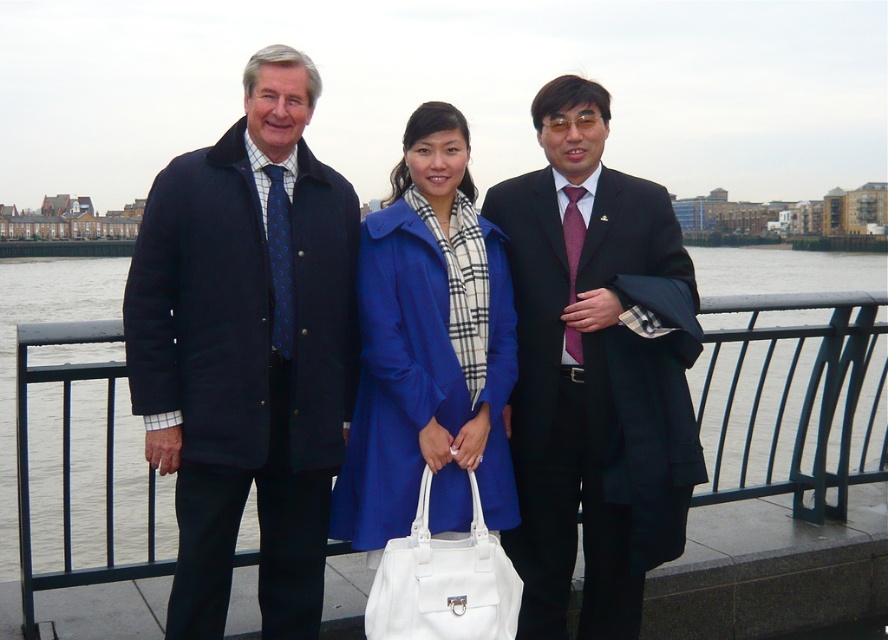
You are a photographer trying to capture a clear shot of the matte black water at center and the white leather handbag at center. Which object should you focus on first if you want to ensure both are in focus without adjusting the camera settings?

The matte black water at center is much taller than the white leather handbag at center, so focusing on the taller object first would help ensure both are in focus.

You are a photographer planning to take a group photo of the three individuals in the scene. You want to ensure that both the matte black coat at center and the matte black water at center are clearly visible in the frame. Given that your camera has a minimum focus distance of 15 meters, will you be able to capture both objects in sharp focus?

The distance between the matte black coat at center and the matte black water at center is 18.15 meters. Since the camera requires a minimum focus distance of 15 meters, the 18.15 meters distance exceeds this threshold. Therefore, the camera can focus on both objects as they are beyond the minimum required distance.